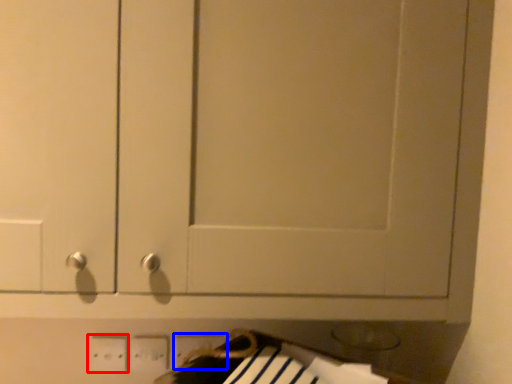
Question: Among these objects, which one is farthest to the camera, electric outlet (highlighted by a red box) or electric outlet (highlighted by a blue box)?

Choices:
 (A) electric outlet
 (B) electric outlet

Answer: (B)